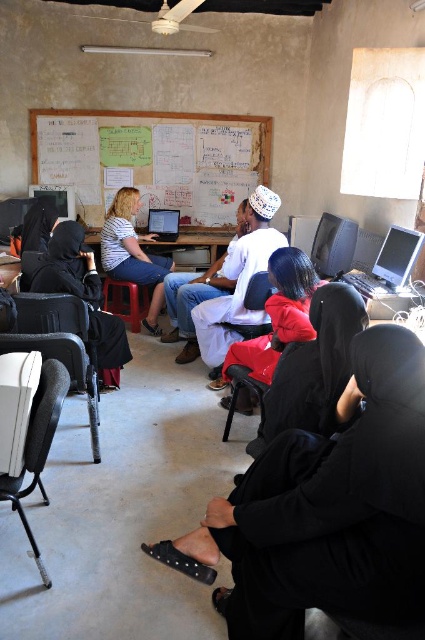
Which is above, white cotton shirt at center or matte plastic chair at center?

white cotton shirt at center is higher up.

Describe the element at coordinates (238, 280) in the screenshot. This screenshot has height=640, width=425. I see `white cotton shirt at center` at that location.

Who is more forward, (201, 307) or (144, 307)?

Positioned in front is point (201, 307).

Locate an element on the screen. The height and width of the screenshot is (640, 425). white cotton shirt at center is located at coordinates (238, 280).

Can you confirm if white paperboard at upper center is smaller than matte black laptop at center?

Actually, white paperboard at upper center might be larger than matte black laptop at center.

Who is more distant from viewer, (129, 132) or (155, 236)?

The point (155, 236) is more distant.

Image resolution: width=425 pixels, height=640 pixels. Find the location of `white paperboard at upper center`. white paperboard at upper center is located at coordinates (155, 157).

Describe the element at coordinates (155, 157) in the screenshot. I see `white paperboard at upper center` at that location.

Consider the image. Is white paperboard at upper center shorter than white cotton shirt at center?

Indeed, white paperboard at upper center has a lesser height compared to white cotton shirt at center.

Is point (254, 115) closer to viewer compared to point (235, 273)?

No, (254, 115) is further to viewer.

Where is `white paperboard at upper center`? The height and width of the screenshot is (640, 425). white paperboard at upper center is located at coordinates tap(155, 157).